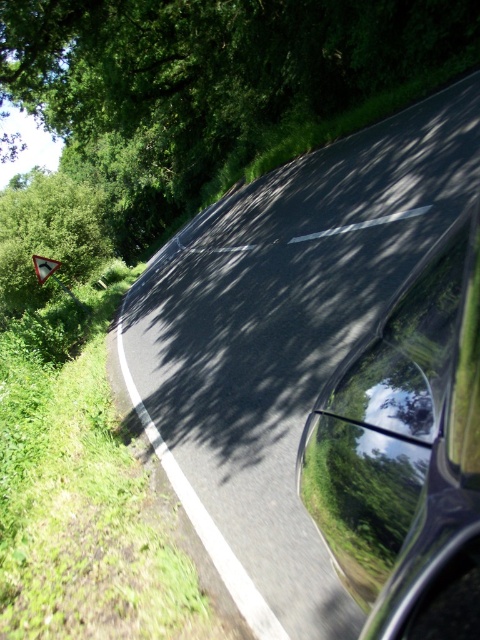
Question: Which of the following is the closest to the observer?

Choices:
 (A) glossy black car window at center
 (B) white plastic triangle at left

Answer: (A)

Question: Among these objects, which one is farthest from the camera?

Choices:
 (A) metallic triangular sign at center
 (B) glossy black car window at center

Answer: (A)

Question: Estimate the real-world distances between objects in this image. Which object is closer to the metallic triangular sign at center?

Choices:
 (A) white plastic triangle at left
 (B) glossy black car window at center

Answer: (A)

Question: From the image, what is the correct spatial relationship of white plastic triangle at left in relation to metallic triangular sign at center?

Choices:
 (A) right
 (B) left

Answer: (B)

Question: From the image, what is the correct spatial relationship of white plastic triangle at left in relation to metallic triangular sign at center?

Choices:
 (A) above
 (B) below

Answer: (B)

Question: Does white plastic triangle at left come in front of metallic triangular sign at center?

Choices:
 (A) yes
 (B) no

Answer: (B)